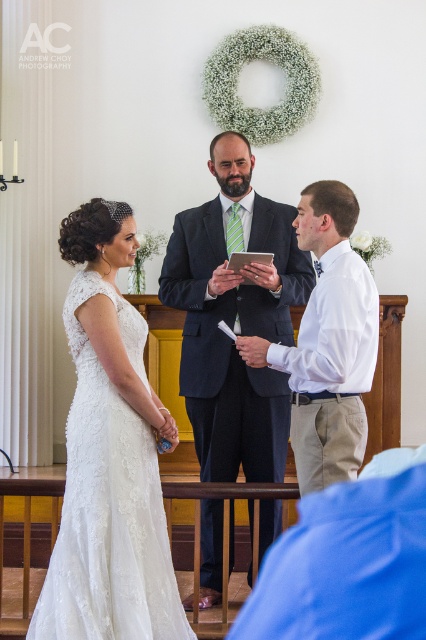
Does lace fabric dress at left have a lesser height compared to white cotton shirt at center?

No, lace fabric dress at left is not shorter than white cotton shirt at center.

Who is more distant from viewer, [89,598] or [319,193]?

The point [319,193] is more distant.

What are the coordinates of `lace fabric dress at left` in the screenshot? It's located at (109, 456).

Between dark blue suit at center and white cotton shirt at center, which one is positioned higher?

white cotton shirt at center

Can you confirm if dark blue suit at center is positioned below white cotton shirt at center?

Yes.

Which is in front, point (201, 410) or point (325, 428)?

Positioned in front is point (325, 428).

Locate an element on the screen. Image resolution: width=426 pixels, height=640 pixels. dark blue suit at center is located at coordinates [235, 317].

Does point (120, 227) come farther from viewer compared to point (163, 291)?

No.

Is white lace dress at left positioned before dark blue suit at center?

No, white lace dress at left is further to the viewer.

Image resolution: width=426 pixels, height=640 pixels. I want to click on white lace dress at left, so click(x=244, y=308).

Locate an element on the screen. The image size is (426, 640). white lace dress at left is located at coordinates (244, 308).